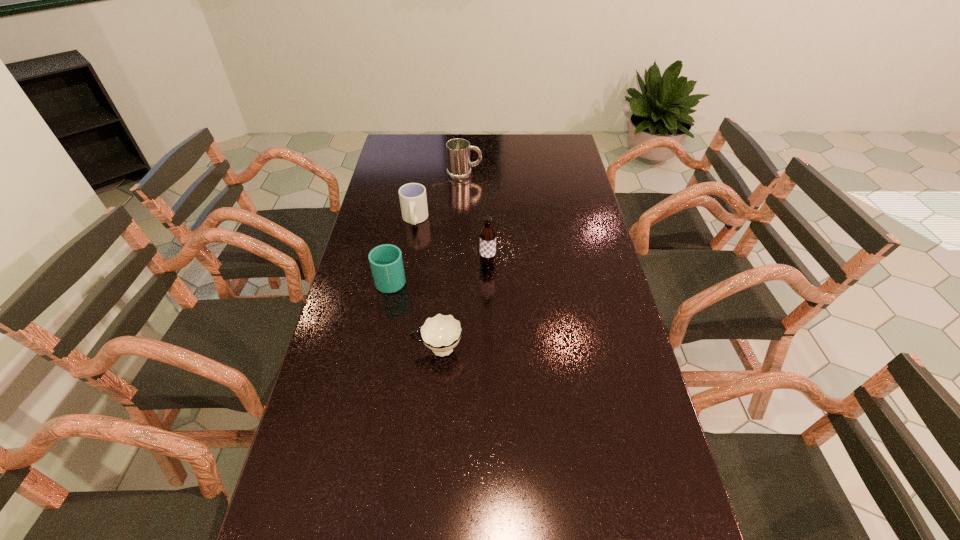
I want to click on root beer, so click(x=487, y=252).

Identify the location of mug. (459, 165).

Locate an element on the screen. The height and width of the screenshot is (540, 960). the second nearest cup is located at coordinates (386, 262).

You are a GUI agent. You are given a task and a screenshot of the screen. Output one action in this format:
    pyautogui.click(x=<x>, y=<y>)
    Task: Click on the fifth nearest object
    The height and width of the screenshot is (540, 960).
    Given the screenshot: What is the action you would take?
    pyautogui.click(x=413, y=201)

The image size is (960, 540). Find the location of `the rightmost cup`. the rightmost cup is located at coordinates (441, 333).

Find the location of a particular element. the second shortest object is located at coordinates pos(441,333).

Locate an element on the screen. The height and width of the screenshot is (540, 960). free location located on the front of the root beer is located at coordinates (489, 332).

Locate an element on the screen. This screenshot has height=540, width=960. vacant space located 0.260m on the side of the mug with the handle is located at coordinates (544, 175).

The height and width of the screenshot is (540, 960). In order to click on free space located 0.160m on the handle side of the second nearest cup in this screenshot , I will do [400, 234].

The width and height of the screenshot is (960, 540). I want to click on vacant point located 0.160m on the handle side of the second nearest cup, so click(x=400, y=234).